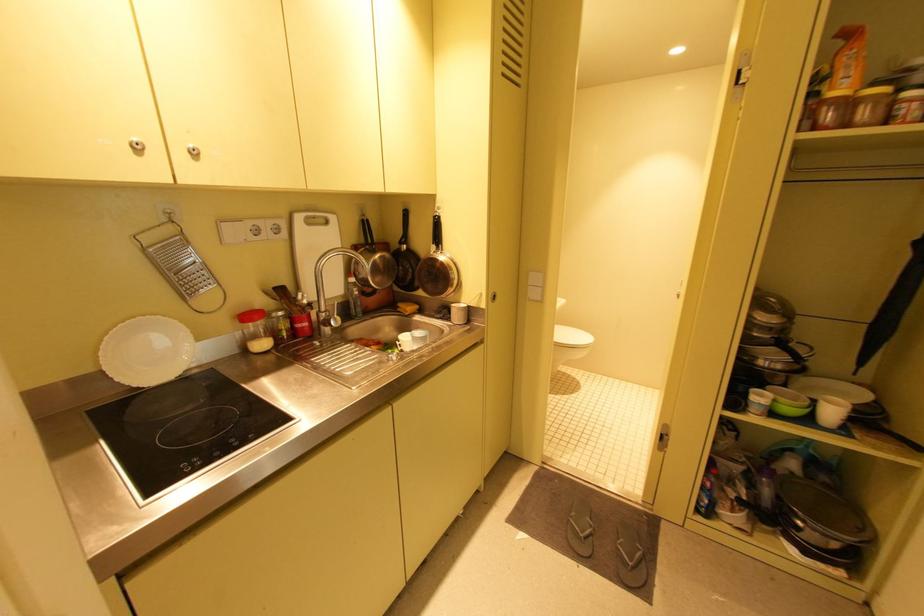
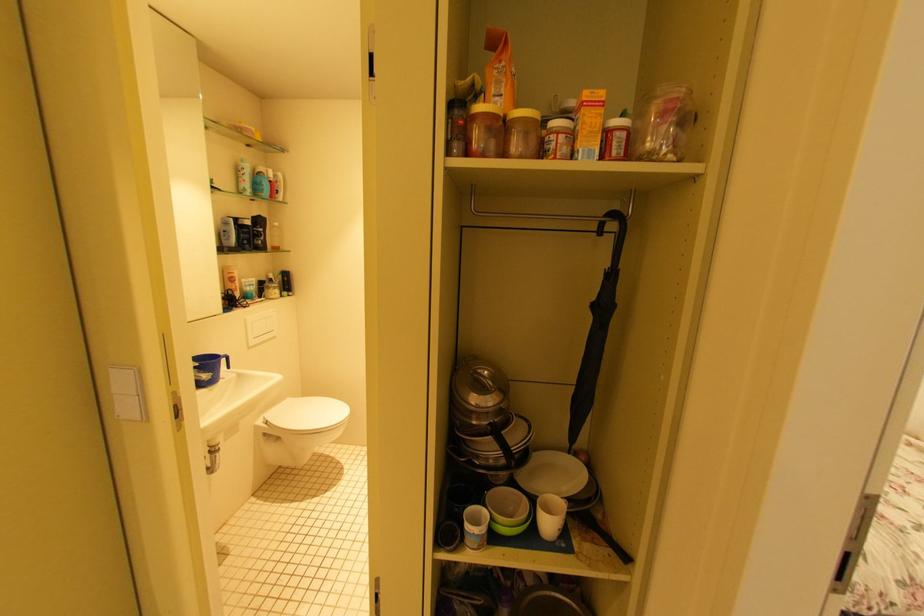
Question: The camera is either moving clockwise (left) or counter-clockwise (right) around the object. The first image is from the beginning of the video and the second image is from the end. Is the camera moving left or right when shooting the video?

Choices:
 (A) Left
 (B) Right

Answer: (A)